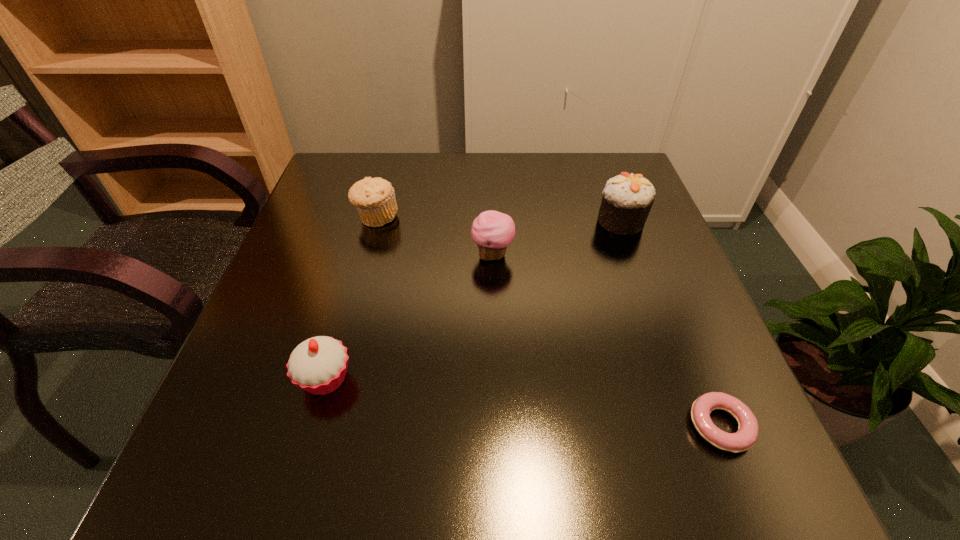
Where is `vacant space at the far left corner`? vacant space at the far left corner is located at coordinates (362, 173).

In the image, there is a desktop. What are the coordinates of `vacant space at the near left corner` in the screenshot? It's located at (273, 469).

Identify the location of free space at the far right corner of the desktop. (609, 166).

Image resolution: width=960 pixels, height=540 pixels. Find the location of `free space between the doughnut and the third nearest object`. free space between the doughnut and the third nearest object is located at coordinates (607, 340).

What are the coordinates of `free space between the shortest object and the second farthest cupcake` in the screenshot? It's located at (607, 340).

Identify the location of blank region between the muffin and the doughnut. (548, 322).

At what (x,y) coordinates should I click in order to perform the action: click on free space between the second farthest cupcake and the muffin. Please return your answer as a coordinate pair (x, y). The image size is (960, 540). Looking at the image, I should click on (x=435, y=236).

Locate an element on the screen. The width and height of the screenshot is (960, 540). vacant area between the rightmost cupcake and the shortest object is located at coordinates (671, 323).

This screenshot has height=540, width=960. I want to click on unoccupied position between the leftmost cupcake and the farthest cupcake, so pos(473,300).

Locate an element on the screen. empty space that is in between the nearest cupcake and the farthest cupcake is located at coordinates (473, 300).